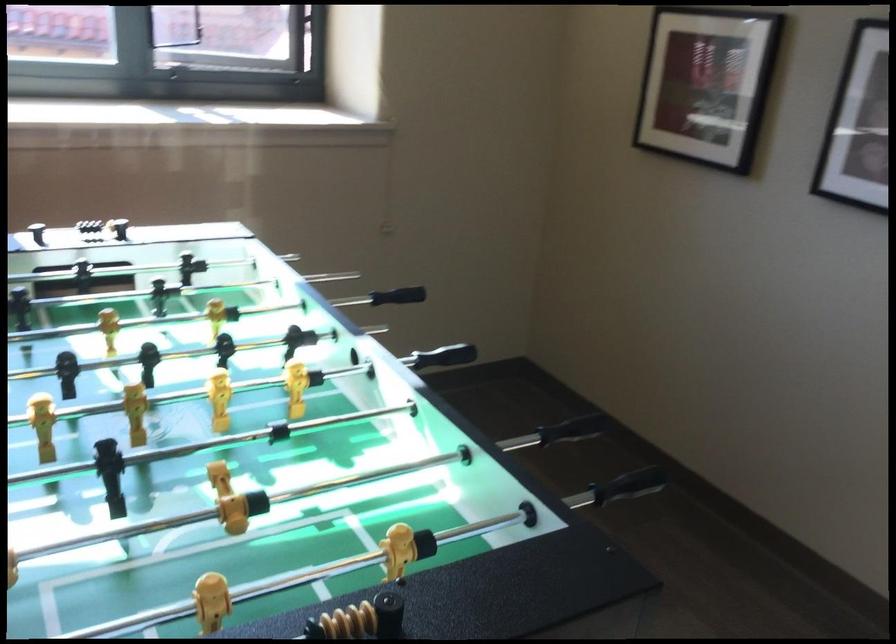
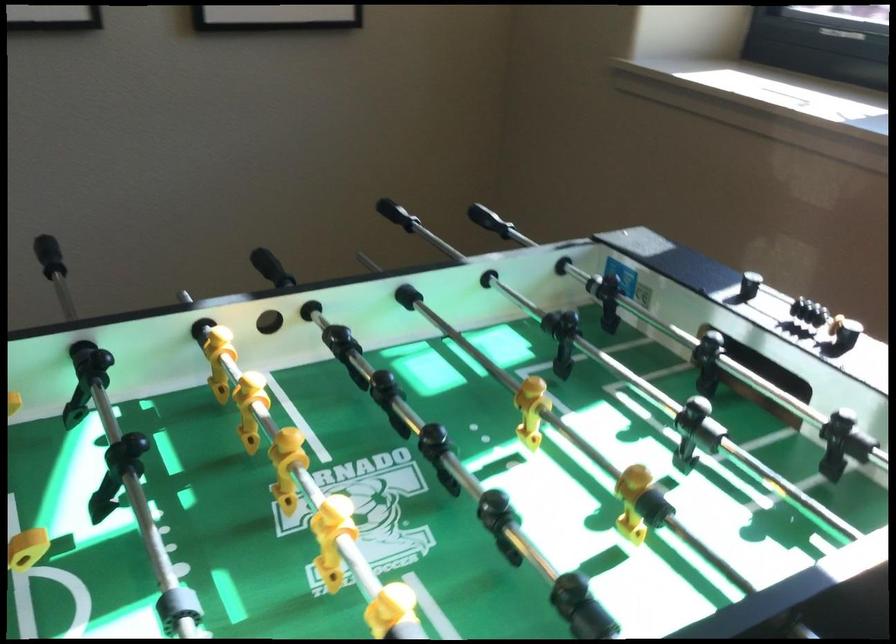
Locate, in the second image, the point that corresponds to (x=79, y=230) in the first image.

(819, 315)